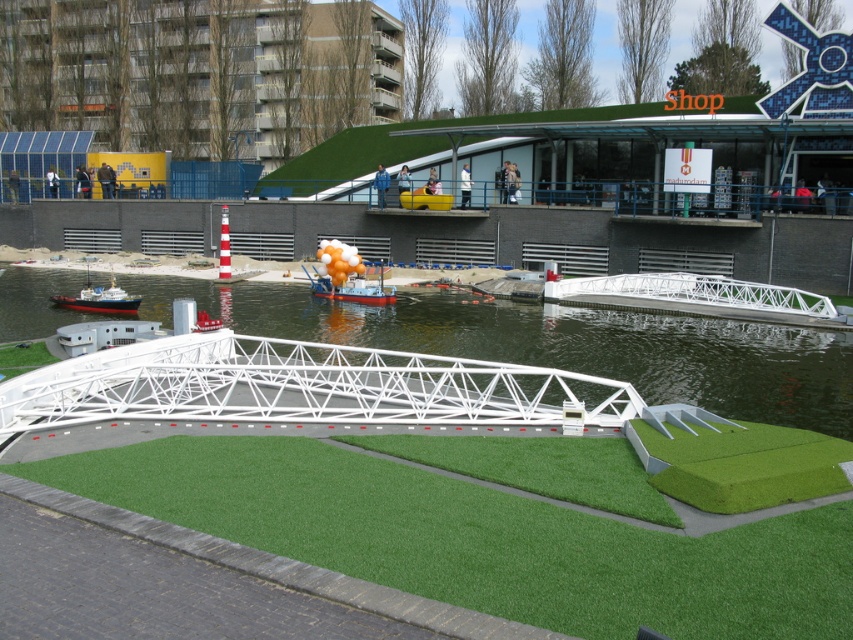
Who is more forward, [704,317] or [119,307]?

Positioned in front is point [119,307].

Does white plastic water at center have a lesser width compared to red and white plastic boat at left?

Incorrect, white plastic water at center's width is not less than red and white plastic boat at left's.

Is point (492, 349) positioned behind point (140, 300)?

That is False.

Image resolution: width=853 pixels, height=640 pixels. Find the location of `white plastic water at center`. white plastic water at center is located at coordinates (508, 339).

Which is more to the right, green artificial turf at center or red and white plastic boat at left?

Positioned to the right is green artificial turf at center.

Which is behind, point (434, 557) or point (54, 296)?

The point (54, 296) is more distant.

Find the location of a particular element. This screenshot has width=853, height=640. green artificial turf at center is located at coordinates (480, 540).

Is point (234, 506) closer to camera compared to point (827, 428)?

Yes, it is.

Between green artificial turf at center and white plastic water at center, which one has more height?

Standing taller between the two is white plastic water at center.

Describe the element at coordinates (480, 540) in the screenshot. I see `green artificial turf at center` at that location.

The image size is (853, 640). In order to click on green artificial turf at center in this screenshot , I will do `click(480, 540)`.